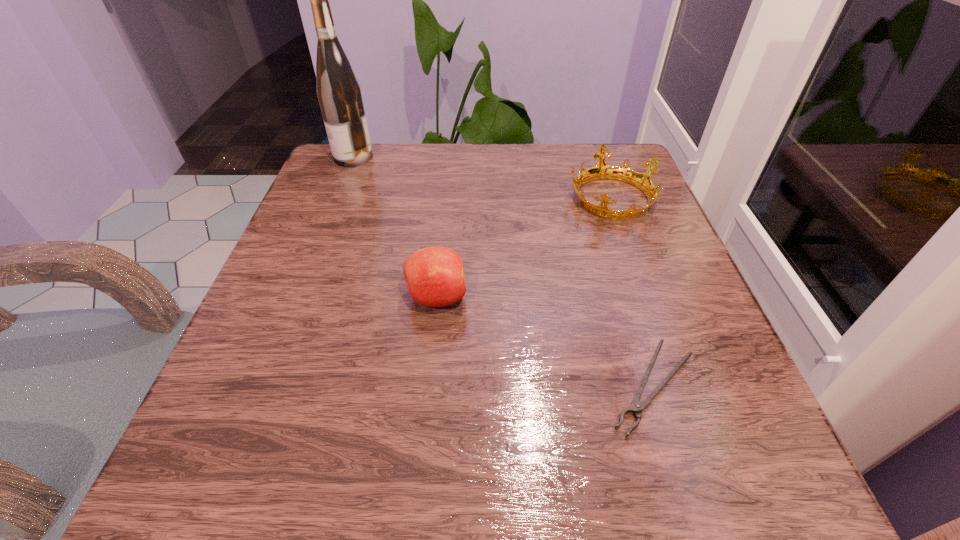
Locate an element on the screen. The height and width of the screenshot is (540, 960). free space that satisfies the following two spatial constraints: 1. on the front side of the second nearest object; 2. on the left side of the tallest object is located at coordinates (299, 298).